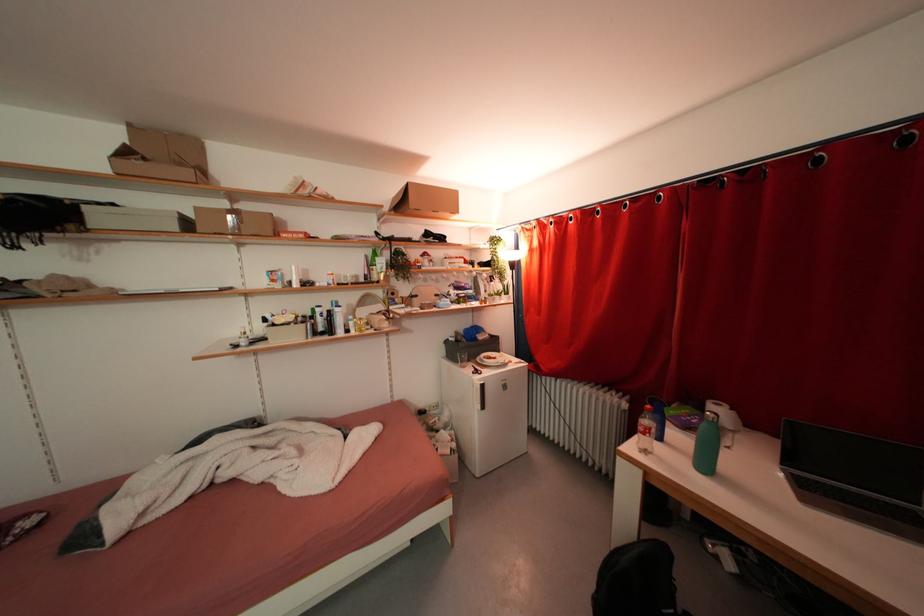
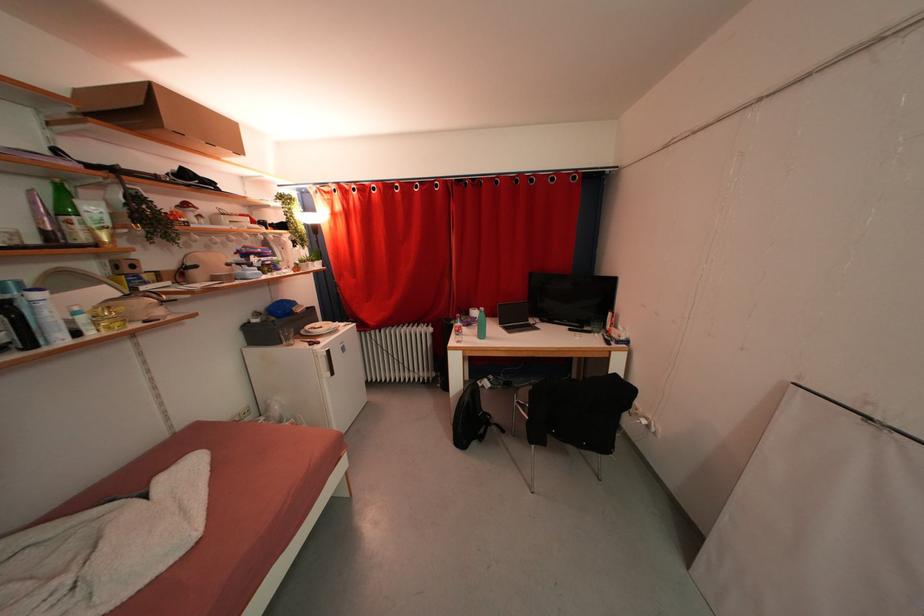
In the second image, find the point that corresponds to (630,408) in the first image.

(436, 333)